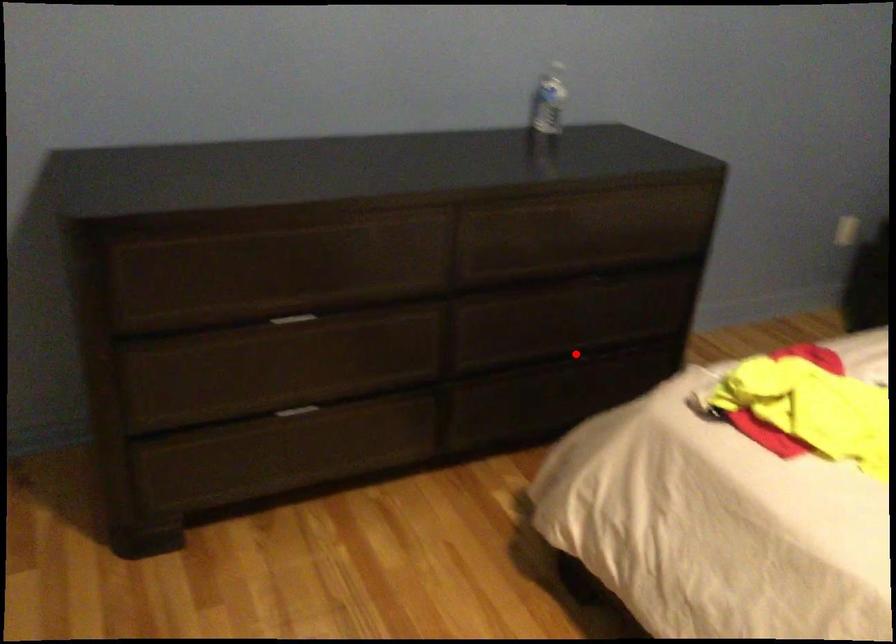
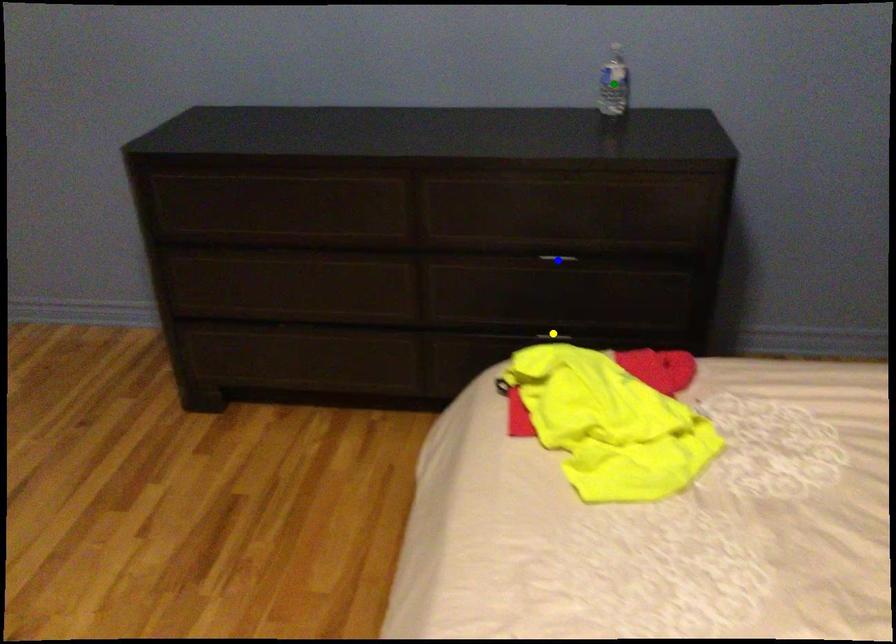
Question: I am providing you with two images of the same scene from different viewpoints. A red point is marked on the first image. You are given multiple points on the second image. Which mark in image 2 goes with the point in image 1?

Choices:
 (A) green point
 (B) blue point
 (C) yellow point

Answer: (C)